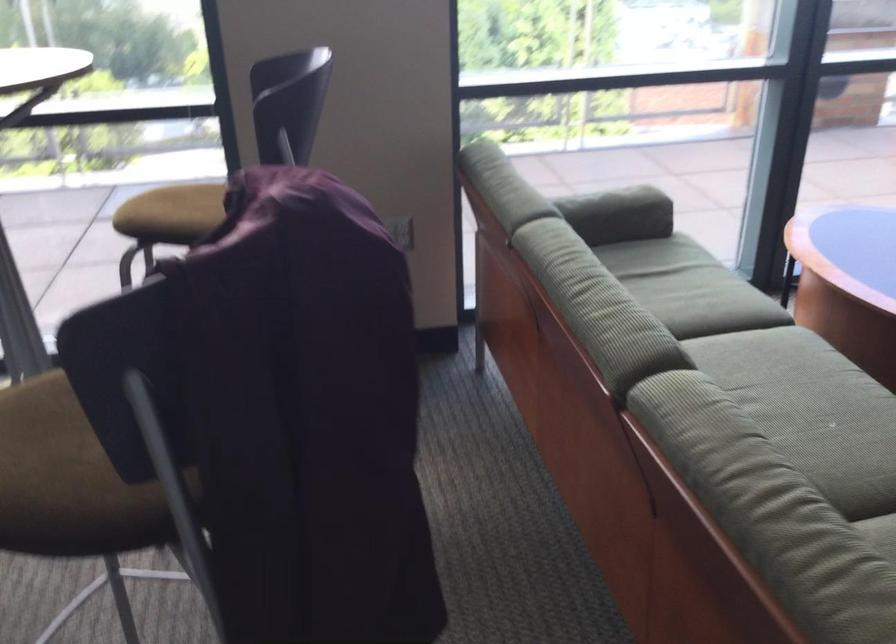
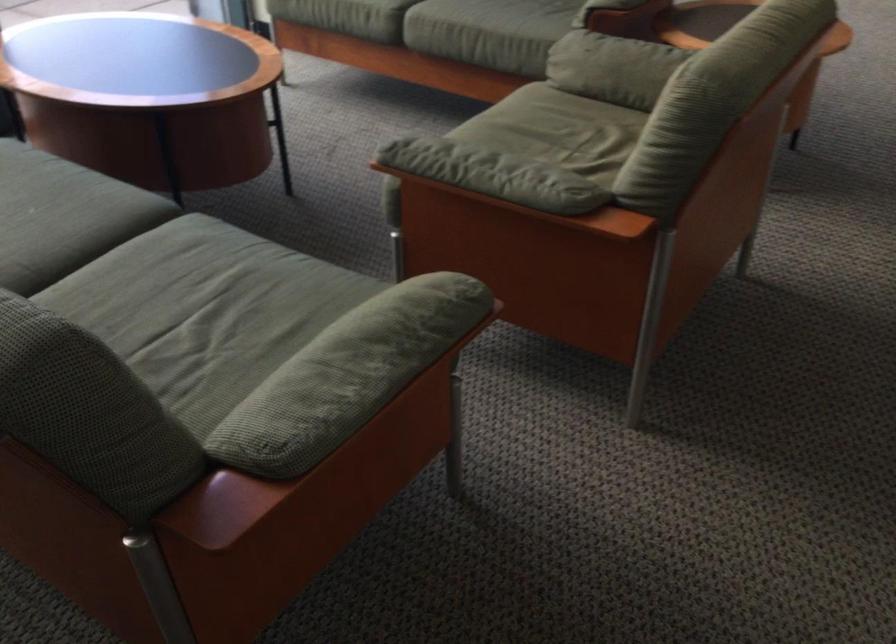
Question: The camera is either moving clockwise (left) or counter-clockwise (right) around the object. The first image is from the beginning of the video and the second image is from the end. Is the camera moving left or right when shooting the video?

Choices:
 (A) Left
 (B) Right

Answer: (A)